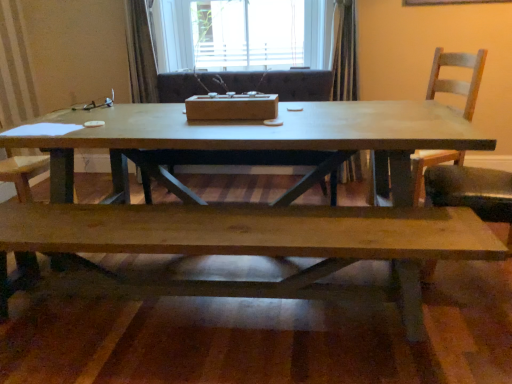
The width and height of the screenshot is (512, 384). What do you see at coordinates (457, 80) in the screenshot? I see `wooden chair at right` at bounding box center [457, 80].

This screenshot has height=384, width=512. What do you see at coordinates (239, 34) in the screenshot?
I see `white wood window at upper center` at bounding box center [239, 34].

You are a GUI agent. You are given a task and a screenshot of the screen. Output one action in this format:
    pyautogui.click(x=<x>, y=<y>)
    Task: Click on the white wood window at upper center
    The width and height of the screenshot is (512, 384).
    Given the screenshot: What is the action you would take?
    pyautogui.click(x=239, y=34)

Where is `natural wood bench at lower center`? This screenshot has height=384, width=512. natural wood bench at lower center is located at coordinates (254, 244).

Image resolution: width=512 pixels, height=384 pixels. I want to click on wooden armchair at center, so click(x=247, y=84).

Does matte wood coffee table at center have a smaller size compared to white wood window at upper center?

No, matte wood coffee table at center is not smaller than white wood window at upper center.

How many degrees apart are the facing directions of matte wood coffee table at center and white wood window at upper center?

91.4 degrees separate the facing orientations of matte wood coffee table at center and white wood window at upper center.

Which is nearer, (455, 124) or (161, 16)?

The point (455, 124) is in front.

Between matte wood coffee table at center and white wood window at upper center, which one has more height?

matte wood coffee table at center is taller.

Which is behind, matte wood coffee table at center or wooden armchair at center?

wooden armchair at center.

How many degrees apart are the facing directions of matte wood coffee table at center and wooden armchair at center?

The facing directions of matte wood coffee table at center and wooden armchair at center are 1.69 degrees apart.

From their relative heights in the image, would you say matte wood coffee table at center is taller or shorter than wooden armchair at center?

In the image, matte wood coffee table at center appears to be shorter than wooden armchair at center.

Considering the relative sizes of matte wood coffee table at center and wooden armchair at center in the image provided, is matte wood coffee table at center smaller than wooden armchair at center?

Actually, matte wood coffee table at center might be larger than wooden armchair at center.

Considering the relative sizes of natural wood bench at lower center and white wood window at upper center in the image provided, is natural wood bench at lower center bigger than white wood window at upper center?

Yes, natural wood bench at lower center is bigger than white wood window at upper center.

Is natural wood bench at lower center taller than white wood window at upper center?

No.

Is natural wood bench at lower center oriented away from white wood window at upper center?

No, natural wood bench at lower center is not facing away from white wood window at upper center.

Measure the distance between natural wood bench at lower center and white wood window at upper center.

natural wood bench at lower center and white wood window at upper center are 2.86 meters apart.

Which object is wider, wooden armchair at center or wooden chair at right?

With larger width is wooden armchair at center.

Considering the points (141, 174) and (430, 156), which point is in front, point (141, 174) or point (430, 156)?

The point (141, 174) is more forward.

Considering the relative sizes of wooden armchair at center and wooden chair at right in the image provided, is wooden armchair at center shorter than wooden chair at right?

Indeed, wooden armchair at center has a lesser height compared to wooden chair at right.

Is matte wood coffee table at center looking in the opposite direction of wooden chair at right?

Yes, matte wood coffee table at center is positioned with its back facing wooden chair at right.

The image size is (512, 384). Identify the location of chair lying above the matte wood coffee table at center (from the image's perspective). (457, 80).

Is point (447, 108) less distant than point (447, 65)?

Yes, point (447, 108) is in front of point (447, 65).

Is matte wood coffee table at center not near wooden chair at right?

Yes.

Considering the sizes of white wood window at upper center and matte wood coffee table at center in the image, is white wood window at upper center wider or thinner than matte wood coffee table at center?

Considering their sizes, white wood window at upper center looks broader than matte wood coffee table at center.

Can you tell me how much white wood window at upper center and matte wood coffee table at center differ in facing direction?

The facing directions of white wood window at upper center and matte wood coffee table at center are 91.4 degrees apart.

In the image, is white wood window at upper center positioned in front of or behind matte wood coffee table at center?

Clearly, white wood window at upper center is behind matte wood coffee table at center.

I want to click on coffee table in front of the white wood window at upper center, so click(x=252, y=137).

Is matte wood coffee table at center located within natural wood bench at lower center?

Actually, matte wood coffee table at center is outside natural wood bench at lower center.

Which object is thinner, natural wood bench at lower center or matte wood coffee table at center?

With smaller width is natural wood bench at lower center.

In the scene shown: Does natural wood bench at lower center appear on the left side of matte wood coffee table at center?

Yes.

Is natural wood bench at lower center turned away from matte wood coffee table at center?

Yes, natural wood bench at lower center is positioned with its back facing matte wood coffee table at center.

Find the location of a particular element. This screenshot has height=384, width=512. window located above the matte wood coffee table at center (from the image's perspective) is located at coordinates (239, 34).

Identify the location of armchair on the right side of matte wood coffee table at center. This screenshot has width=512, height=384. (247, 84).

Based on their spatial positions, is wooden armchair at center or wooden chair at right closer to natural wood bench at lower center?

wooden armchair at center is positioned closer to the anchor natural wood bench at lower center.

Based on their spatial positions, is wooden chair at right or wooden armchair at center further from natural wood bench at lower center?

Among the two, wooden chair at right is located further to natural wood bench at lower center.

From the image, which object appears to be nearer to wooden chair at right, wooden armchair at center or natural wood bench at lower center?

The object closer to wooden chair at right is wooden armchair at center.

Estimate the real-world distances between objects in this image. Which object is closer to wooden chair at right, natural wood bench at lower center or wooden armchair at center?

wooden armchair at center lies closer to wooden chair at right than the other object.

Which object lies nearer to the anchor point white wood window at upper center, wooden armchair at center or natural wood bench at lower center?

wooden armchair at center is closer to white wood window at upper center.

Estimate the real-world distances between objects in this image. Which object is closer to matte wood coffee table at center, natural wood bench at lower center or white wood window at upper center?

Based on the image, natural wood bench at lower center appears to be nearer to matte wood coffee table at center.

When comparing their distances from matte wood coffee table at center, does wooden chair at right or natural wood bench at lower center seem further?

Based on the image, wooden chair at right appears to be further to matte wood coffee table at center.

When comparing their distances from wooden armchair at center, does natural wood bench at lower center or wooden chair at right seem further?

Based on the image, natural wood bench at lower center appears to be further to wooden armchair at center.

Find the location of a particular element. This screenshot has width=512, height=384. coffee table located between natural wood bench at lower center and wooden chair at right in the left-right direction is located at coordinates (252, 137).

This screenshot has height=384, width=512. I want to click on chair between natural wood bench at lower center and white wood window at upper center from front to back, so click(x=457, y=80).

The width and height of the screenshot is (512, 384). Identify the location of coffee table located between natural wood bench at lower center and wooden armchair at center in the depth direction. (252, 137).

Identify the location of coffee table positioned between natural wood bench at lower center and white wood window at upper center from near to far. The width and height of the screenshot is (512, 384). (252, 137).